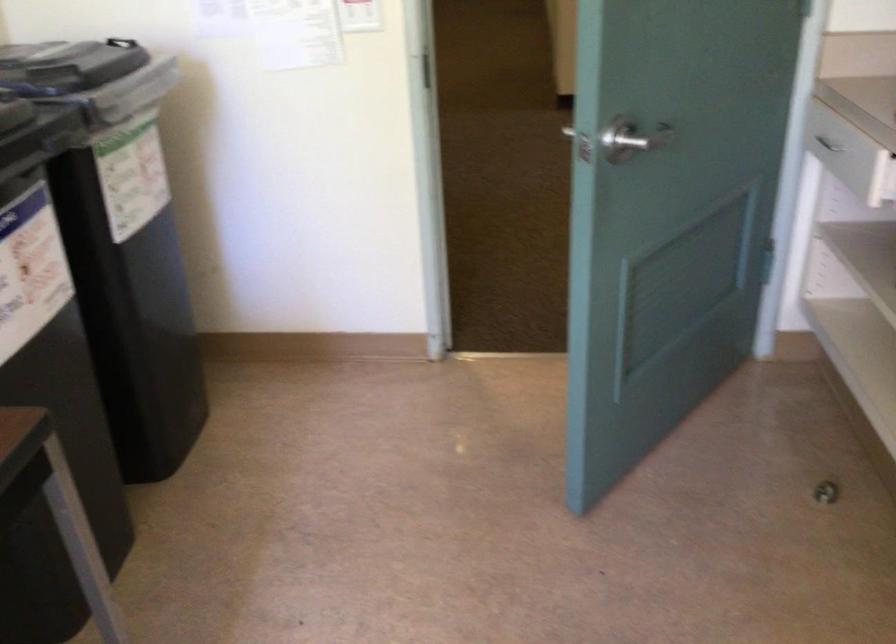
Find the location of a particular element. door stop is located at coordinates (832, 494).